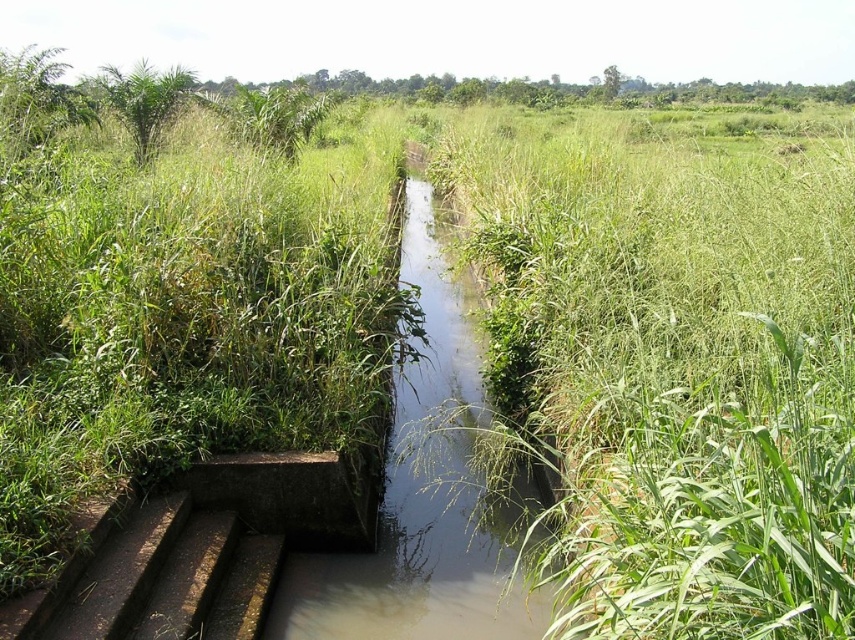
Does muddy concrete stream at center have a greater height compared to rusty metal stairs at lower left?

Indeed, muddy concrete stream at center has a greater height compared to rusty metal stairs at lower left.

Describe the element at coordinates (428, 493) in the screenshot. I see `muddy concrete stream at center` at that location.

Find the location of a particular element. muddy concrete stream at center is located at coordinates tap(428, 493).